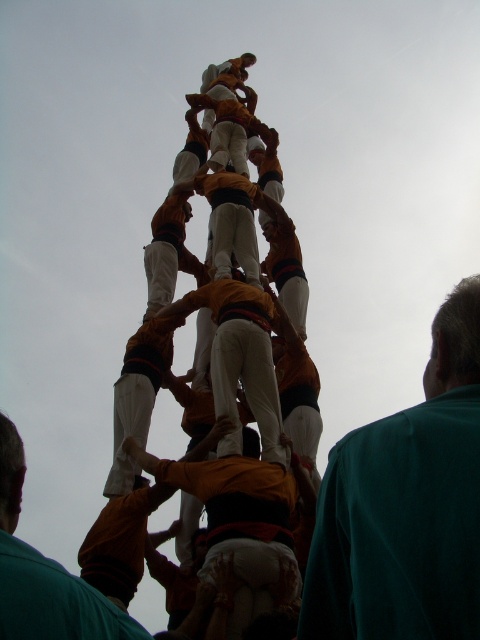
Question: Is green fabric shirt at lower right below orange fabric man at center?

Choices:
 (A) no
 (B) yes

Answer: (A)

Question: Which of the following is the farthest from the observer?

Choices:
 (A) orange fabric man at center
 (B) orange fabric at center

Answer: (A)

Question: Is the position of green fabric shirt at lower right more distant than that of orange fabric at center?

Choices:
 (A) yes
 (B) no

Answer: (B)

Question: Can you confirm if orange fabric man at center is positioned above orange fabric at center?

Choices:
 (A) yes
 (B) no

Answer: (B)

Question: Among these points, which one is farthest from the camera?

Choices:
 (A) (207, 550)
 (B) (24, 465)

Answer: (A)

Question: Among these objects, which one is farthest from the camera?

Choices:
 (A) orange fabric man at center
 (B) orange fabric at center
 (C) green fabric shirt at lower right

Answer: (A)